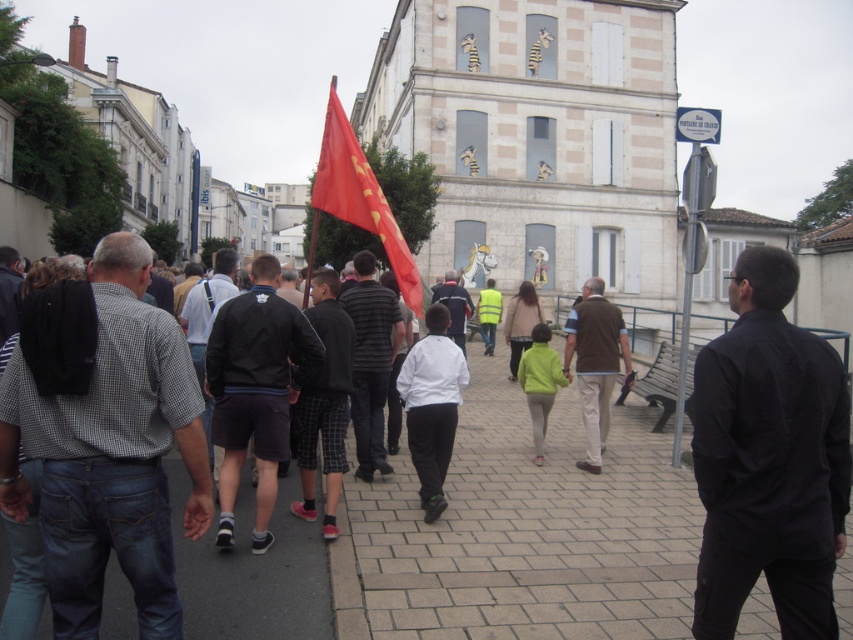
You are standing at the entrance of the street and want to walk to the building with cartoon characters painted on it. According to the image, where should you step to follow the brick paved sidewalk at center?

You should step at point (521,532) to follow the brick paved sidewalk at center towards the building with cartoon characters painted on it.